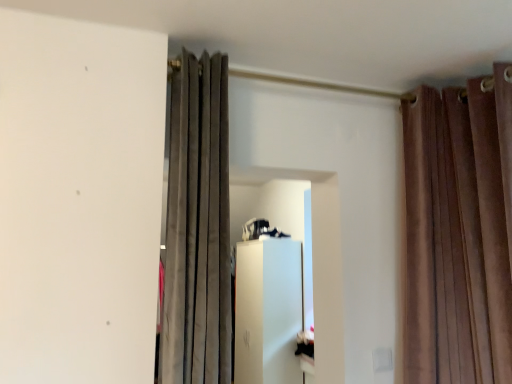
Question: Which direction should I rotate to look at suede curtain at center, the 1th curtain viewed from the left?

Choices:
 (A) right
 (B) left

Answer: (B)

Question: Does brown velvet curtains at upper right, which is the first curtain from right to left, have a greater width compared to suede curtain at center, the 1th curtain viewed from the left?

Choices:
 (A) no
 (B) yes

Answer: (A)

Question: Is brown velvet curtains at upper right, placed as the 2th curtain when sorted from left to right, positioned beyond the bounds of suede curtain at center, which is counted as the second curtain, starting from the right?

Choices:
 (A) yes
 (B) no

Answer: (A)

Question: From a real-world perspective, is brown velvet curtains at upper right, placed as the 2th curtain when sorted from left to right, located higher than suede curtain at center, which is counted as the second curtain, starting from the right?

Choices:
 (A) no
 (B) yes

Answer: (A)

Question: Is brown velvet curtains at upper right, which is the first curtain from right to left, positioned with its back to suede curtain at center, which is counted as the second curtain, starting from the right?

Choices:
 (A) yes
 (B) no

Answer: (B)

Question: Can you confirm if brown velvet curtains at upper right, placed as the 2th curtain when sorted from left to right, is taller than suede curtain at center, which is counted as the second curtain, starting from the right?

Choices:
 (A) no
 (B) yes

Answer: (B)

Question: Can suede curtain at center, the 1th curtain viewed from the left, be found inside brown velvet curtains at upper right, placed as the 2th curtain when sorted from left to right?

Choices:
 (A) yes
 (B) no

Answer: (B)

Question: Could brown velvet curtains at upper right, which is the first curtain from right to left, be considered to be inside suede curtain at center, the 1th curtain viewed from the left?

Choices:
 (A) yes
 (B) no

Answer: (B)

Question: Is there a large distance between suede curtain at center, the 1th curtain viewed from the left, and brown velvet curtains at upper right, placed as the 2th curtain when sorted from left to right?

Choices:
 (A) no
 (B) yes

Answer: (A)

Question: Can you confirm if suede curtain at center, the 1th curtain viewed from the left, is shorter than brown velvet curtains at upper right, placed as the 2th curtain when sorted from left to right?

Choices:
 (A) yes
 (B) no

Answer: (A)

Question: Does suede curtain at center, which is counted as the second curtain, starting from the right, come in front of brown velvet curtains at upper right, placed as the 2th curtain when sorted from left to right?

Choices:
 (A) no
 (B) yes

Answer: (B)

Question: Considering the relative sizes of suede curtain at center, the 1th curtain viewed from the left, and brown velvet curtains at upper right, placed as the 2th curtain when sorted from left to right, in the image provided, is suede curtain at center, the 1th curtain viewed from the left, taller than brown velvet curtains at upper right, placed as the 2th curtain when sorted from left to right,?

Choices:
 (A) yes
 (B) no

Answer: (B)

Question: Is the position of suede curtain at center, the 1th curtain viewed from the left, more distant than that of brown velvet curtains at upper right, which is the first curtain from right to left?

Choices:
 (A) yes
 (B) no

Answer: (B)

Question: Is suede curtain at center, the 1th curtain viewed from the left, inside or outside of brown velvet curtains at upper right, which is the first curtain from right to left?

Choices:
 (A) outside
 (B) inside

Answer: (A)